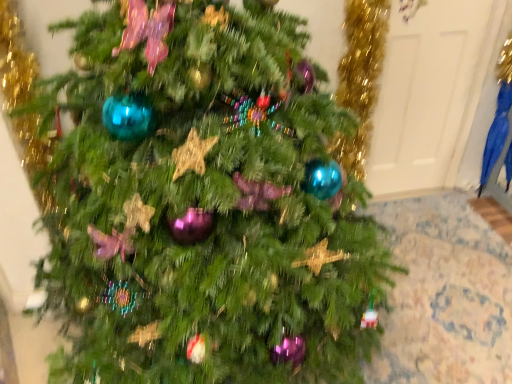
This screenshot has width=512, height=384. I want to click on white matte door at upper right, so click(x=429, y=94).

This screenshot has height=384, width=512. What do you see at coordinates (429, 94) in the screenshot?
I see `white matte door at upper right` at bounding box center [429, 94].

The width and height of the screenshot is (512, 384). I want to click on white matte door at upper right, so click(x=429, y=94).